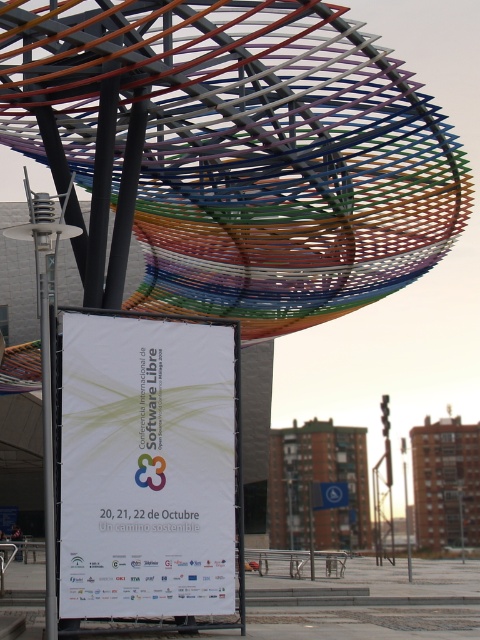
Which is above, metallic wire mesh canopy at upper center or white paper at center?

Positioned higher is metallic wire mesh canopy at upper center.

Based on the photo, can you confirm if metallic wire mesh canopy at upper center is positioned above white paper at center?

Yes.

Between point (266, 76) and point (168, 488), which one is positioned behind?

Positioned behind is point (266, 76).

Find the location of a particular element. metallic wire mesh canopy at upper center is located at coordinates (245, 148).